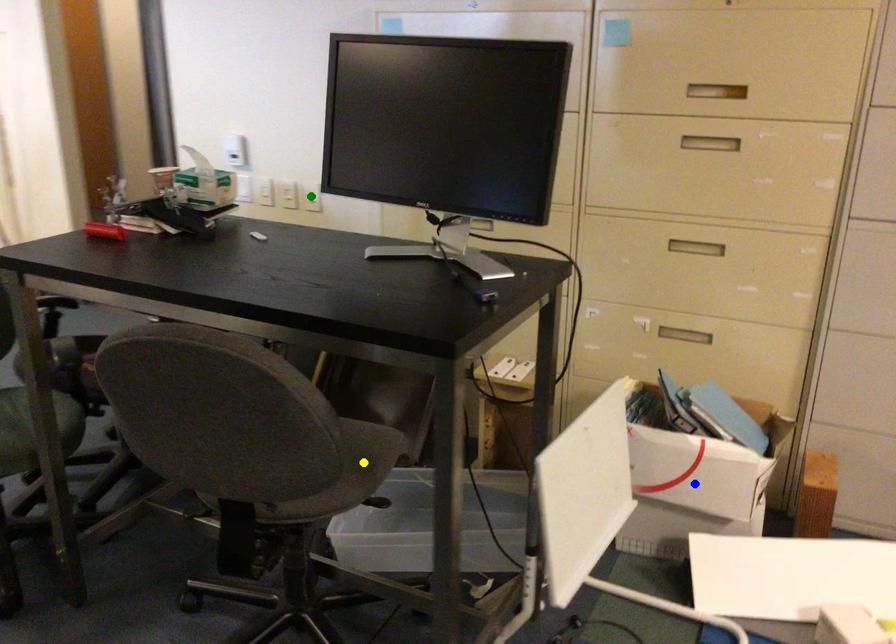
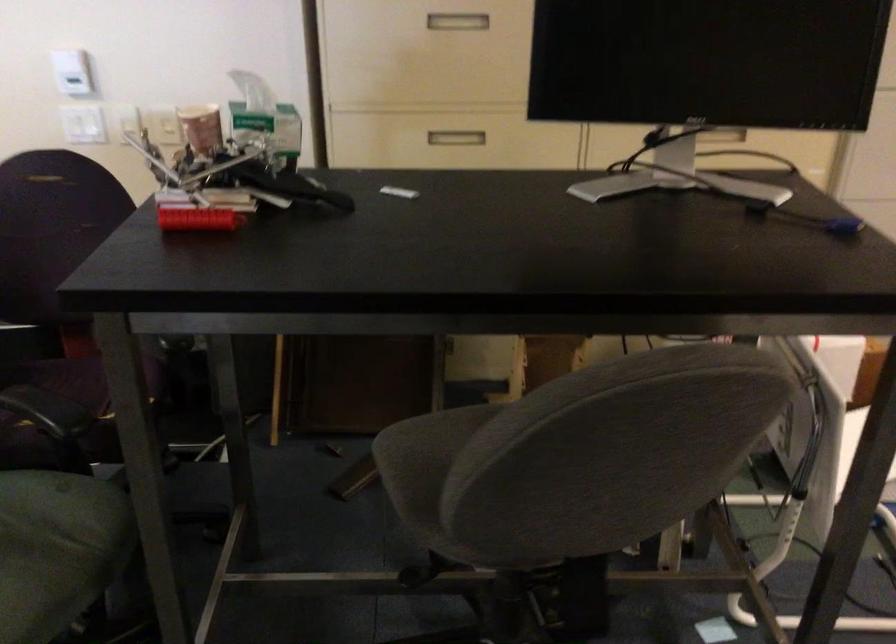
I am providing you with two images of the same scene from different viewpoints. Three points are marked in image1. Which point corresponds to a part or object that is occluded in image2?In image1, three points are marked. Which of them correspond to a part or object that is occluded in image2?Among the three points shown in image1, which one corresponds to a part or object that is no longer visible due to occlusion in image2?

green point, blue point, yellow point